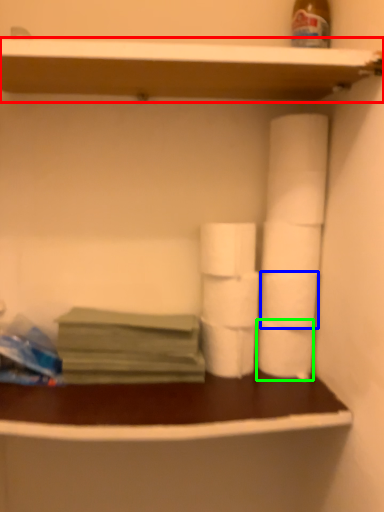
Question: Which object is the farthest from shelf (highlighted by a red box)? Choose among these: toilet paper (highlighted by a blue box) or toilet paper (highlighted by a green box).

Choices:
 (A) toilet paper
 (B) toilet paper

Answer: (B)